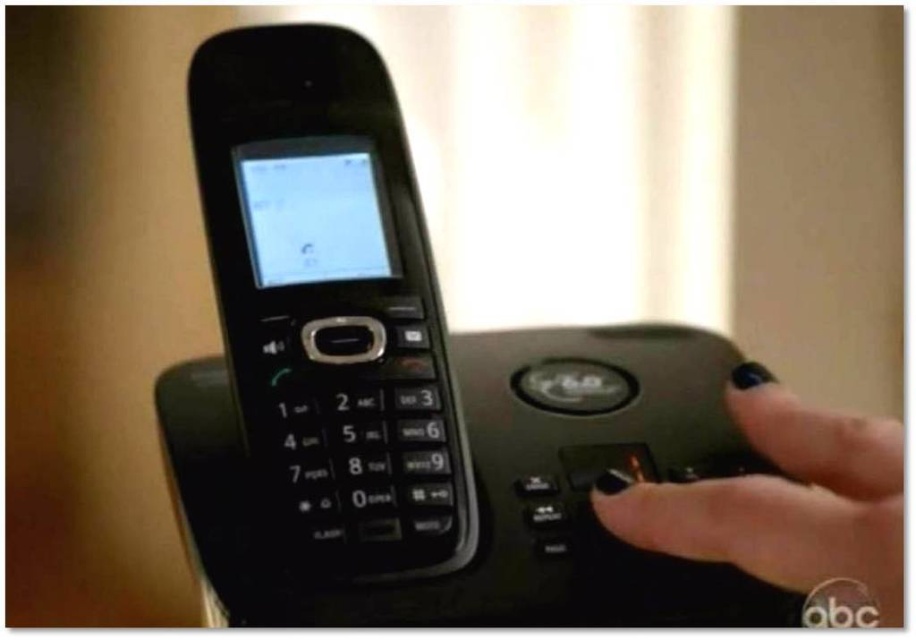
Question: Does black plastic phone at center appear over black polished nail at right?

Choices:
 (A) yes
 (B) no

Answer: (A)

Question: Which object is closer to the camera taking this photo?

Choices:
 (A) black polished nail at right
 (B) black plastic phone at center

Answer: (A)

Question: Among these points, which one is farthest from the camera?

Choices:
 (A) (695, 500)
 (B) (328, 177)

Answer: (B)

Question: In this image, where is black plastic phone at center located relative to black polished nail at right?

Choices:
 (A) below
 (B) above

Answer: (B)

Question: Is black plastic phone at center behind black polished nail at right?

Choices:
 (A) no
 (B) yes

Answer: (B)